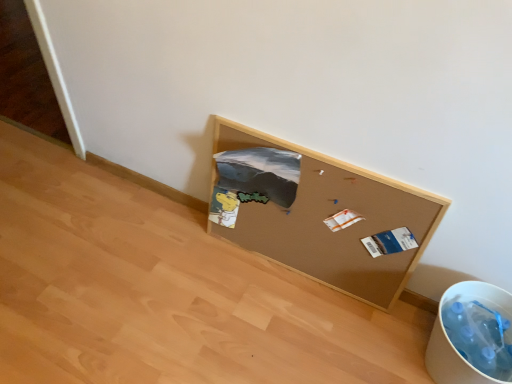
Question: Is corkboard at lower right positioned with its back to white plastic recycling bin at lower right?

Choices:
 (A) yes
 (B) no

Answer: (B)

Question: Is corkboard at lower right positioned far away from white plastic recycling bin at lower right?

Choices:
 (A) no
 (B) yes

Answer: (A)

Question: Is corkboard at lower right further to camera compared to white plastic recycling bin at lower right?

Choices:
 (A) no
 (B) yes

Answer: (B)

Question: From a real-world perspective, is corkboard at lower right physically above white plastic recycling bin at lower right?

Choices:
 (A) yes
 (B) no

Answer: (A)

Question: Is corkboard at lower right taller than white plastic recycling bin at lower right?

Choices:
 (A) no
 (B) yes

Answer: (B)

Question: Is corkboard at lower right located outside white plastic recycling bin at lower right?

Choices:
 (A) yes
 (B) no

Answer: (A)

Question: Is white plastic recycling bin at lower right aimed at corkboard at lower right?

Choices:
 (A) no
 (B) yes

Answer: (A)

Question: Is white plastic recycling bin at lower right outside of corkboard at lower right?

Choices:
 (A) no
 (B) yes

Answer: (B)

Question: Is white plastic recycling bin at lower right at the right side of corkboard at lower right?

Choices:
 (A) no
 (B) yes

Answer: (B)

Question: Considering the relative sizes of white plastic recycling bin at lower right and corkboard at lower right in the image provided, is white plastic recycling bin at lower right bigger than corkboard at lower right?

Choices:
 (A) no
 (B) yes

Answer: (A)

Question: Is corkboard at lower right inside white plastic recycling bin at lower right?

Choices:
 (A) yes
 (B) no

Answer: (B)

Question: Is white plastic recycling bin at lower right smaller than corkboard at lower right?

Choices:
 (A) yes
 (B) no

Answer: (A)

Question: Is white plastic recycling bin at lower right situated inside corkboard at lower right or outside?

Choices:
 (A) outside
 (B) inside

Answer: (A)